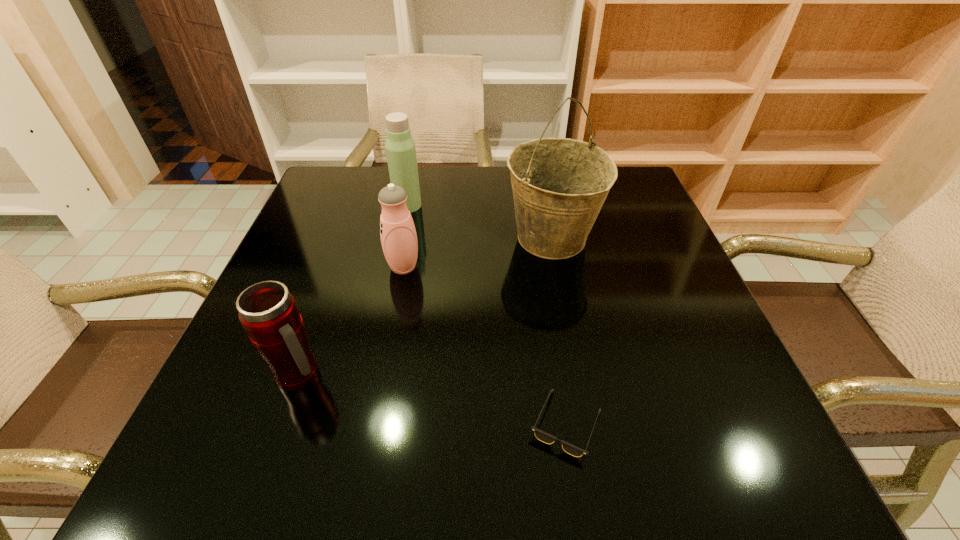
The image size is (960, 540). Find the location of `free space between the tallest object and the shortest object`. free space between the tallest object and the shortest object is located at coordinates (559, 332).

Find the location of a particular element. The width and height of the screenshot is (960, 540). vacant region between the nearest thermos bottle and the farthest thermos bottle is located at coordinates (354, 290).

You are a GUI agent. You are given a task and a screenshot of the screen. Output one action in this format:
    pyautogui.click(x=<x>, y=<y>)
    Task: Click on the vacant region between the wine bucket and the second nearest thermos bottle
    
    Given the screenshot: What is the action you would take?
    pyautogui.click(x=477, y=253)

Where is `free space between the farthest thermos bottle and the wine bucket`? free space between the farthest thermos bottle and the wine bucket is located at coordinates (480, 222).

Locate an element on the screen. This screenshot has height=540, width=960. vacant space in between the wine bucket and the shortest object is located at coordinates (559, 332).

You are a GUI agent. You are given a task and a screenshot of the screen. Output one action in this format:
    pyautogui.click(x=<x>, y=<y>)
    Task: Click on the free space between the nearest thermos bottle and the tallest object
    The image size is (960, 540).
    Given the screenshot: What is the action you would take?
    click(425, 307)

I want to click on vacant space that is in between the nearest thermos bottle and the second farthest thermos bottle, so 351,321.

I want to click on vacant area that lies between the farthest thermos bottle and the sunglasses, so click(487, 315).

Choose which object is the nearest neighbor to the shortest object. Please provide its 2D coordinates. Your answer should be formatted as a tuple, i.e. [(x, y)], where the tuple contains the x and y coordinates of a point satisfying the conditions above.

[(559, 185)]

At what (x,y) coordinates should I click in order to perform the action: click on object that is the fourth closest to the sunglasses. Please return your answer as a coordinate pair (x, y). The width and height of the screenshot is (960, 540). Looking at the image, I should click on (400, 147).